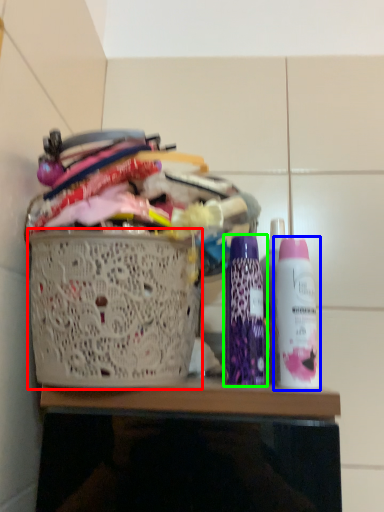
Question: Estimate the real-world distances between objects in this image. Which object is closer to basket (highlighted by a red box), bottle (highlighted by a blue box) or bottle (highlighted by a green box)?

Choices:
 (A) bottle
 (B) bottle

Answer: (B)